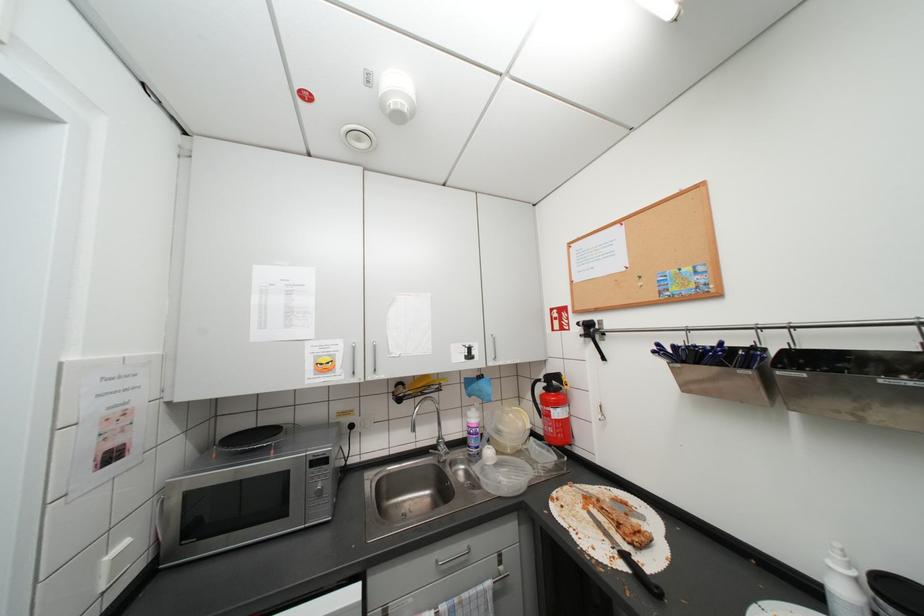
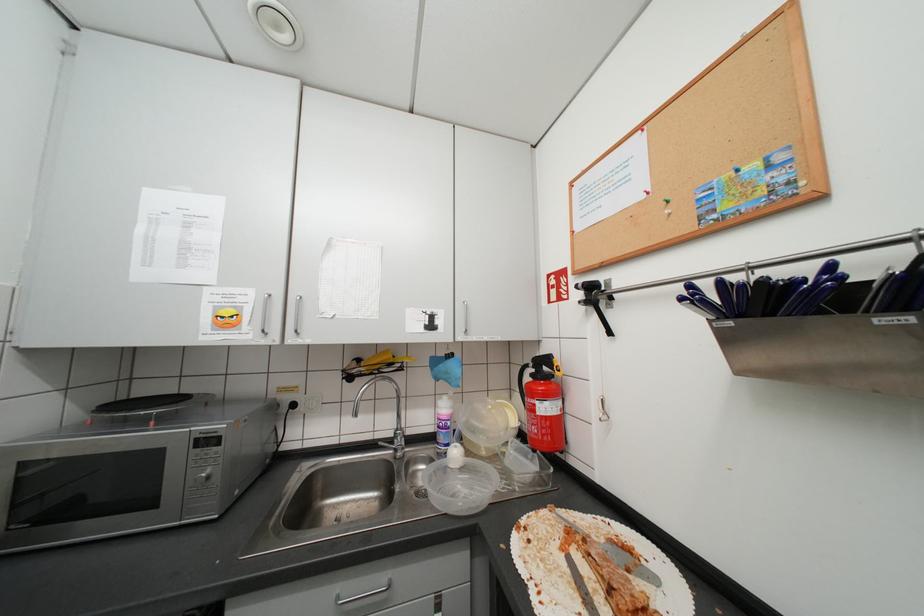
Question: The camera is either moving clockwise (left) or counter-clockwise (right) around the object. The first image is from the beginning of the video and the second image is from the end. Is the camera moving left or right when shooting the video?

Choices:
 (A) Left
 (B) Right

Answer: (B)